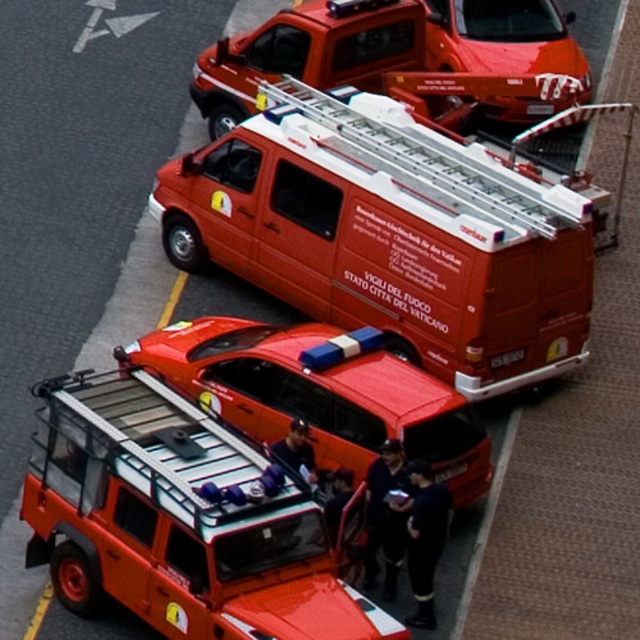
Question: Which point is closer to the camera?

Choices:
 (A) matte orange van at center
 (B) metallic red van at upper center

Answer: (A)

Question: Is matte orange van at center closer to the viewer compared to metallic red car at center?

Choices:
 (A) no
 (B) yes

Answer: (A)

Question: Can you confirm if metallic silver ambulance at center is bigger than metallic red van at upper center?

Choices:
 (A) yes
 (B) no

Answer: (A)

Question: Which object is positioned closest to the metallic silver ambulance at center?

Choices:
 (A) metallic red car at center
 (B) metallic red van at upper center
 (C) matte orange van at center

Answer: (A)

Question: Does matte orange van at center come in front of metallic red car at center?

Choices:
 (A) yes
 (B) no

Answer: (B)

Question: Among these objects, which one is nearest to the camera?

Choices:
 (A) metallic silver ambulance at center
 (B) metallic red van at upper center
 (C) matte orange van at center
 (D) metallic red car at center

Answer: (A)